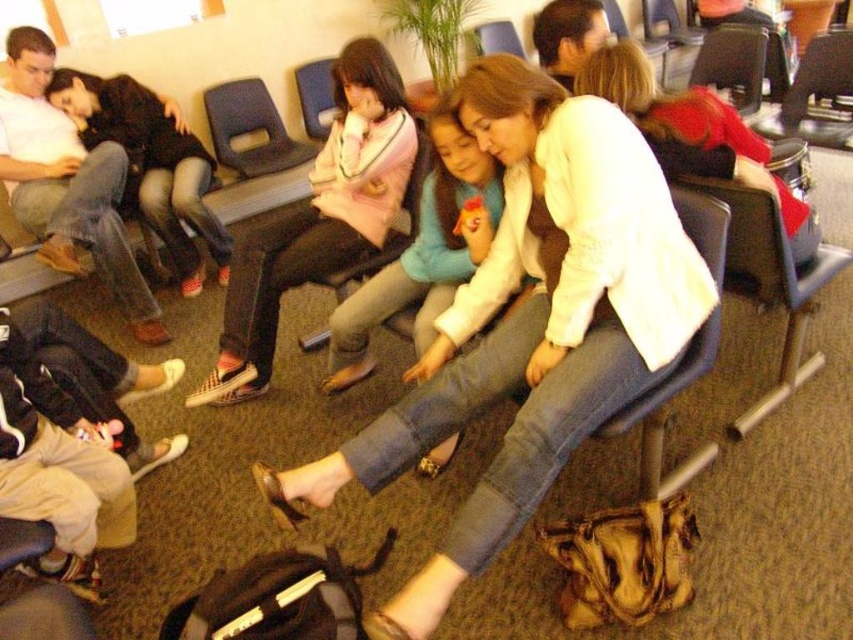
Who is more distant from viewer, (819, 108) or (314, 337)?

Point (819, 108)

From the picture: Does metallic silver chair at upper right have a lesser height compared to matte pink fabric at center?

Indeed, metallic silver chair at upper right has a lesser height compared to matte pink fabric at center.

Where is `metallic silver chair at upper right`? Image resolution: width=853 pixels, height=640 pixels. metallic silver chair at upper right is located at coordinates (816, 93).

Identify the location of metallic silver chair at upper right. The width and height of the screenshot is (853, 640). (816, 93).

Is metallic silver chair at upper right smaller than blue fabric chair at center?

Incorrect, metallic silver chair at upper right is not smaller in size than blue fabric chair at center.

Does metallic silver chair at upper right have a larger size compared to blue fabric chair at center?

Yes.

Between point (811, 134) and point (312, 74), which one is positioned in front?

Positioned in front is point (811, 134).

I want to click on metallic silver chair at upper right, so click(816, 93).

Which is above, blue plastic chair at upper center or wooden chair at center?

wooden chair at center is higher up.

Is point (270, 168) closer to camera compared to point (495, 38)?

Yes, it is in front of point (495, 38).

Is point (223, 124) closer to viewer compared to point (521, 56)?

Yes, it is.

Image resolution: width=853 pixels, height=640 pixels. In order to click on blue plastic chair at upper center in this screenshot , I will do `click(250, 129)`.